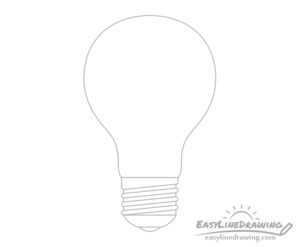
Identify the location of bulb. (162, 41).